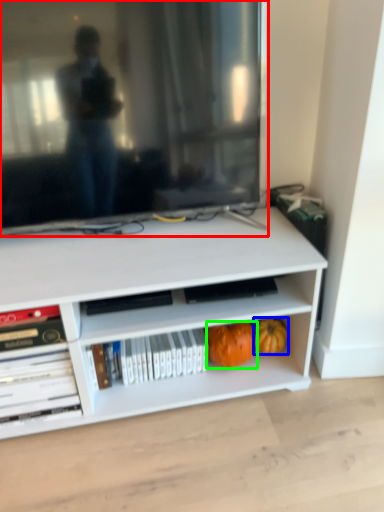
Question: Considering the real-world distances, which object is closest to television (highlighted by a red box)? pumpkin (highlighted by a blue box) or pumpkin (highlighted by a green box).

Choices:
 (A) pumpkin
 (B) pumpkin

Answer: (B)